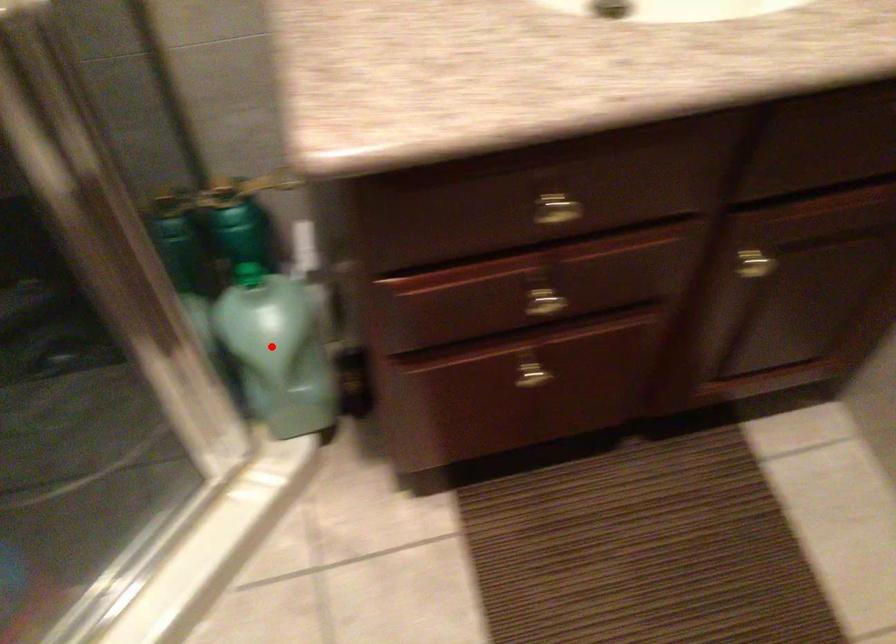
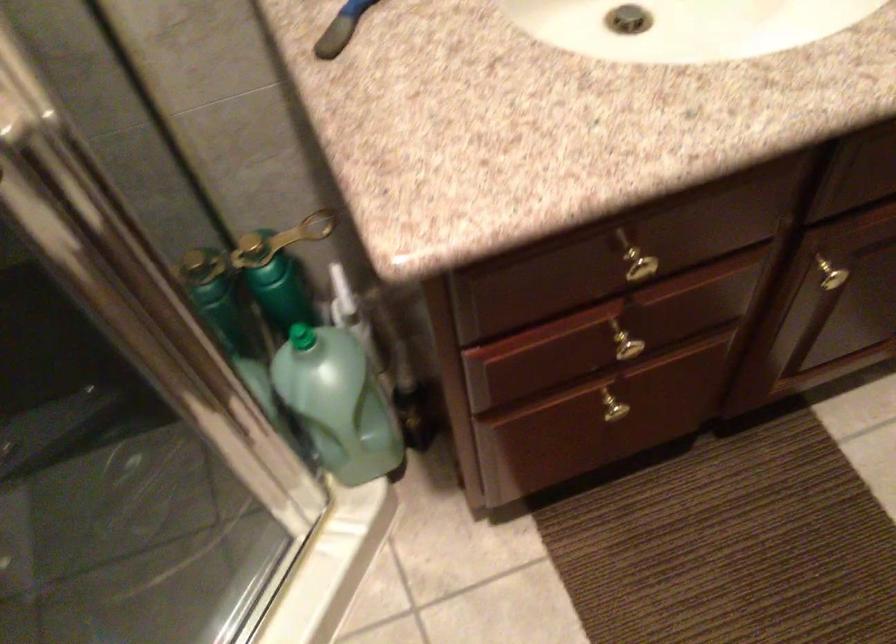
The point at the highlighted location is marked in the first image. Where is the corresponding point in the second image?

(338, 402)